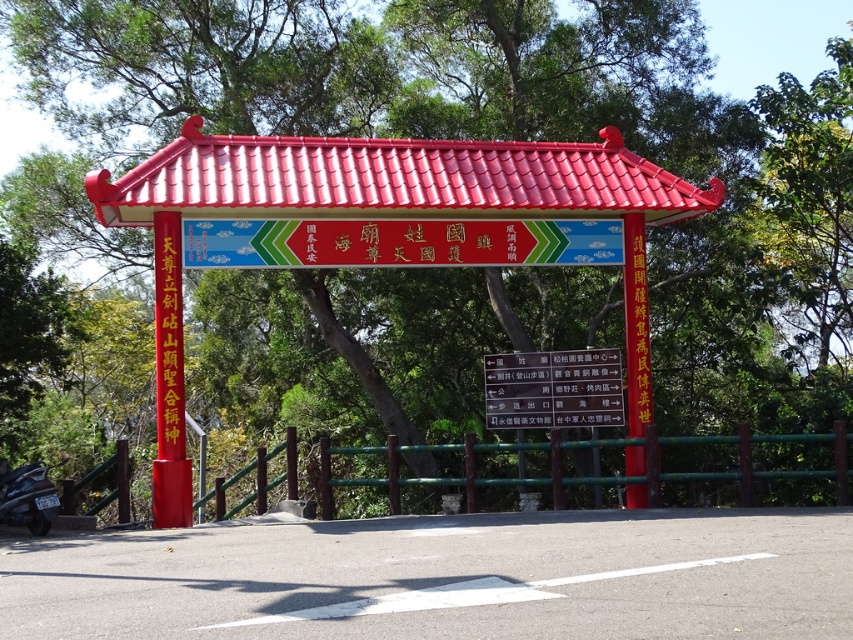
You are a delivery person with a 1.5 meter long package. You need to pass through the gate shown in the image. Can you fit the package vertically between the red tile roof at center and the matte red signboard at center?

The distance between the red tile roof at center and the matte red signboard at center is 1.96 meters. Since the package is 1.5 meters long, it can fit vertically between them.

You are standing 5 feet away from the shiny red gazebo at center. If you walk straight towards the white paper sign at center, how many more feet do you need to walk to reach it?

The distance between the shiny red gazebo at center and the white paper sign at center is 10.47 feet. Since you are already 5 feet away from the gazebo, you need to walk an additional 5.47 feet to reach the sign.

You are standing at the entrance of the traditional Chinese gate and see the shiny red gazebo at center and the black matte motorcycle at lower left. Which object is positioned to the right of the other?

The shiny red gazebo at center is positioned to the right of the black matte motorcycle at lower left.